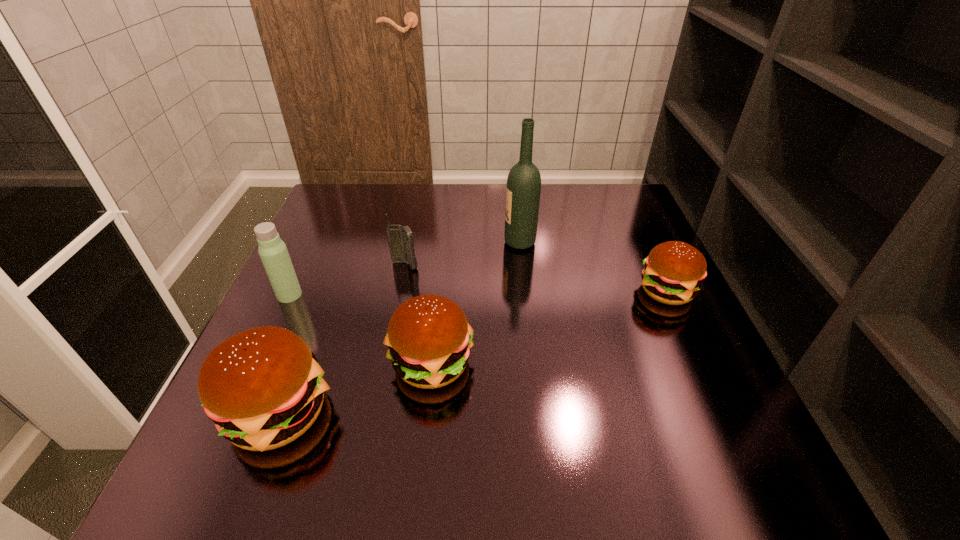
What are the coordinates of `free spot between the fifth object from left to right and the second tallest hamburger` in the screenshot? It's located at (476, 303).

Locate which object is the closest to the cellular telephone. Please provide its 2D coordinates. Your answer should be formatted as a tuple, i.e. [(x, y)], where the tuple contains the x and y coordinates of a point satisfying the conditions above.

[(429, 339)]

Identify which object is the fifth nearest to the leftmost hamburger. Please provide its 2D coordinates. Your answer should be formatted as a tuple, i.e. [(x, y)], where the tuple contains the x and y coordinates of a point satisfying the conditions above.

[(673, 271)]

Locate which hamburger ranks second in proximity to the second shortest hamburger. Please provide its 2D coordinates. Your answer should be formatted as a tuple, i.e. [(x, y)], where the tuple contains the x and y coordinates of a point satisfying the conditions above.

[(673, 271)]

Locate an element on the screen. This screenshot has height=540, width=960. hamburger that is the nearest to the cellular telephone is located at coordinates (429, 339).

Image resolution: width=960 pixels, height=540 pixels. Identify the location of free space that satisfies the following two spatial constraints: 1. on the labeled side of the shortest hamburger; 2. on the left side of the farthest object. (525, 291).